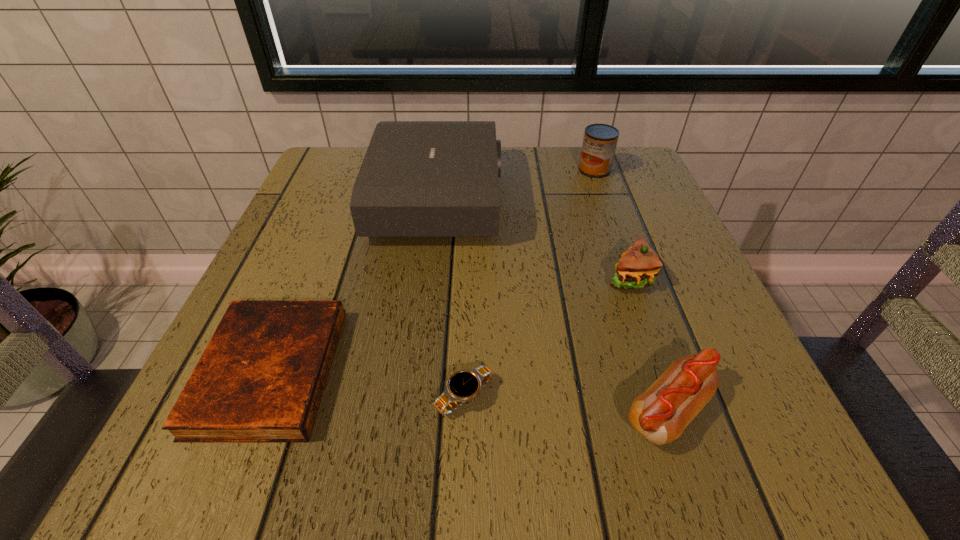
Find the location of `empty space between the sausage and the sandwich`. empty space between the sausage and the sandwich is located at coordinates (649, 344).

You are a GUI agent. You are given a task and a screenshot of the screen. Output one action in this format:
    pyautogui.click(x=<x>, y=<y>)
    Task: Click on the free space between the watch and the sausage
    The image size is (960, 540).
    Given the screenshot: What is the action you would take?
    pyautogui.click(x=566, y=404)

At what (x,y) coordinates should I click in order to perform the action: click on free space between the Bible and the can. Please return your answer as a coordinate pair (x, y). The height and width of the screenshot is (540, 960). Looking at the image, I should click on (432, 271).

In order to click on free space between the Bible and the watch in this screenshot , I will do `click(368, 384)`.

You are a GUI agent. You are given a task and a screenshot of the screen. Output one action in this format:
    pyautogui.click(x=<x>, y=<y>)
    Task: Click on the vacant space that's between the can and the third farthest object
    Image resolution: width=960 pixels, height=540 pixels.
    Given the screenshot: What is the action you would take?
    pyautogui.click(x=612, y=224)

Locate an element on the screen. The image size is (960, 540). vacant space in between the can and the third shortest object is located at coordinates (632, 291).

Identify the location of free point between the third farthest object and the can. This screenshot has height=540, width=960. (612, 224).

Locate an element on the screen. The image size is (960, 540). empty location between the Bible and the projector is located at coordinates (354, 285).

Locate which object ranks fifth in proximity to the can. Please provide its 2D coordinates. Your answer should be formatted as a tuple, i.e. [(x, y)], where the tuple contains the x and y coordinates of a point satisfying the conditions above.

[(261, 378)]

Identify the location of object that is the second closest to the projector. The height and width of the screenshot is (540, 960). (638, 266).